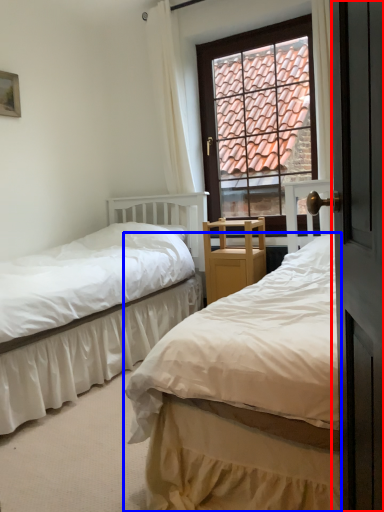
Question: Which object appears closest to the camera in this image, screen door (highlighted by a red box) or bed (highlighted by a blue box)?

Choices:
 (A) screen door
 (B) bed

Answer: (A)